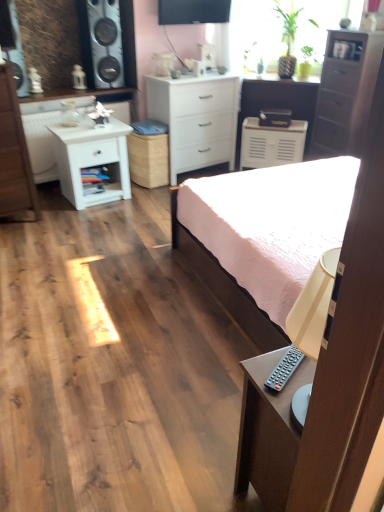
Find the location of a particular element. The height and width of the screenshot is (512, 384). free point in front of white wood chest of drawers at left, which appears as the 3th chest of drawers when viewed from the right is located at coordinates (19, 231).